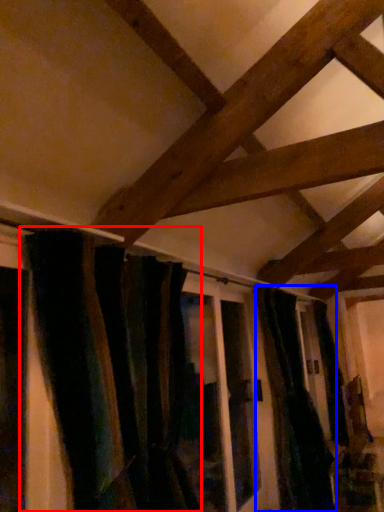
Question: Among these objects, which one is nearest to the camera, curtain (highlighted by a red box) or curtain (highlighted by a blue box)?

Choices:
 (A) curtain
 (B) curtain

Answer: (A)